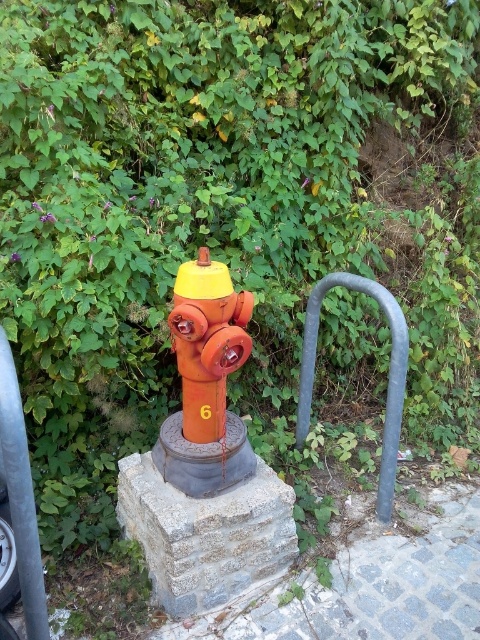
You are standing at the center of the scene. Which direction should you move to reach the brushed metal rail at left?

The brushed metal rail at left is located to your left side, so you should move to your left to reach it.

You are standing in front of the fire hydrant and want to take a photo. There are two points marked in the image, point 1 at coordinates point (7,433) and point 2 at coordinates point (381,483). Which point should you focus on to ensure the hydrant is in sharp focus?

You should focus on point 1 at coordinates point (7,433) because it is closer to the camera than point 2 at coordinates point (381,483), ensuring the hydrant remains in focus.

You are a delivery robot positioned at the origin point of a coordinate system. You need to navigate to the matte orange fire hydrant at center. What are the coordinates you should move towards?

The coordinates to move towards are 0.534 on the x axis and 0.431 on the y axis.